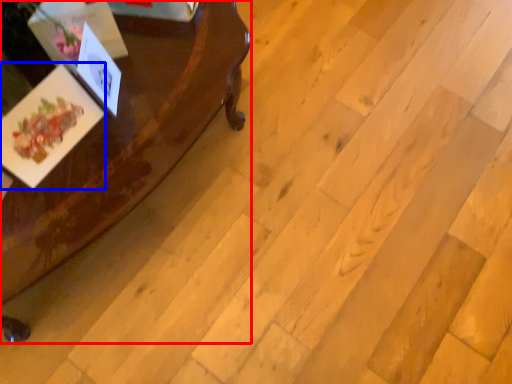
Question: Which object is closer to the camera taking this photo, table (highlighted by a red box) or postcard (highlighted by a blue box)?

Choices:
 (A) table
 (B) postcard

Answer: (A)